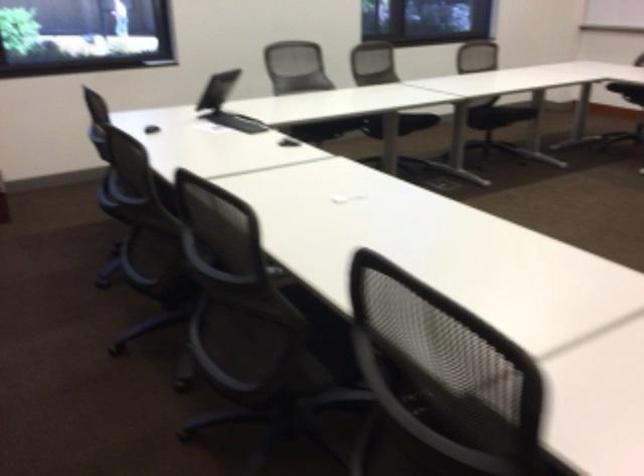
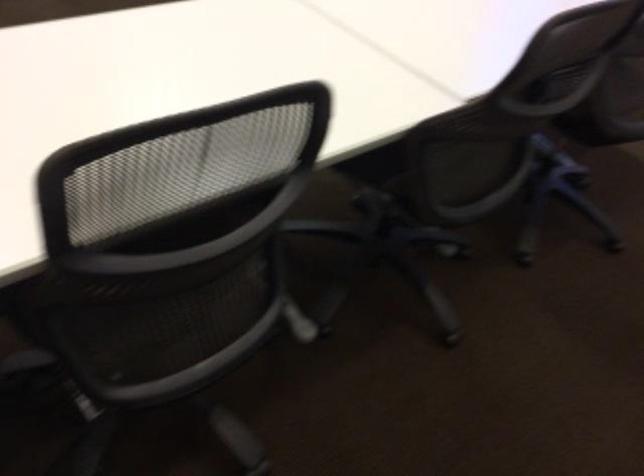
How did the camera likely rotate?

The camera's rotation is toward right-down.